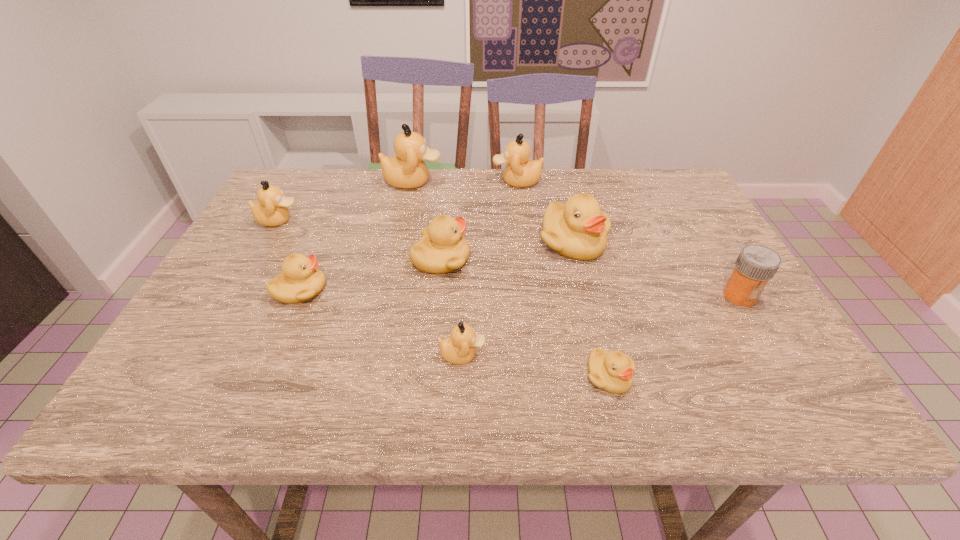
In order to click on vacant space that is in between the biggest yellow duckling and the medicine in this screenshot , I will do `click(657, 268)`.

Find the location of a particular element. This screenshot has width=960, height=540. vacant area that lies between the third tan duckling from right to left and the shortest object is located at coordinates (511, 279).

Choose which object is the fourth nearest neighbor to the smallest tan duckling. Please provide its 2D coordinates. Your answer should be formatted as a tuple, i.e. [(x, y)], where the tuple contains the x and y coordinates of a point satisfying the conditions above.

[(300, 280)]

At what (x,y) coordinates should I click in order to perform the action: click on the eighth closest object to the third tan duckling from left to right. Please return your answer as a coordinate pair (x, y). Looking at the image, I should click on (519, 172).

The height and width of the screenshot is (540, 960). I want to click on duckling identified as the closest to the rightmost tan duckling, so click(407, 170).

Locate which duckling ranks third in proximity to the second duckling from left to right. Please provide its 2D coordinates. Your answer should be formatted as a tuple, i.e. [(x, y)], where the tuple contains the x and y coordinates of a point satisfying the conditions above.

[(460, 348)]

Choose which tan duckling is the nearest neighbor to the second biggest tan duckling. Please provide its 2D coordinates. Your answer should be formatted as a tuple, i.e. [(x, y)], where the tuple contains the x and y coordinates of a point satisfying the conditions above.

[(407, 170)]

The image size is (960, 540). I want to click on the third closest tan duckling to the nearest tan duckling, so click(x=519, y=172).

Where is `the second closest yellow duckling to the biggest yellow duckling`? the second closest yellow duckling to the biggest yellow duckling is located at coordinates (612, 371).

Identify the location of the third closest yellow duckling to the second yellow duckling from left to right. (612, 371).